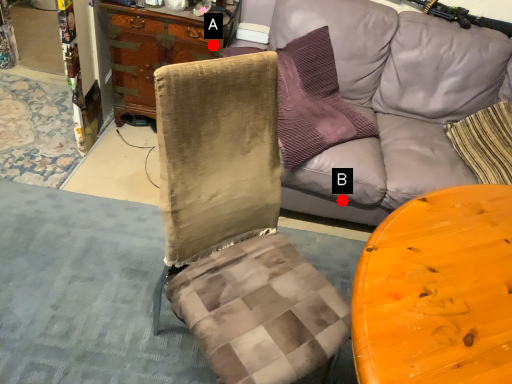
Question: Two points are circled on the image, labeled by A and B beside each circle. Which point is farther from the camera taking this photo?

Choices:
 (A) A is further
 (B) B is further

Answer: (A)